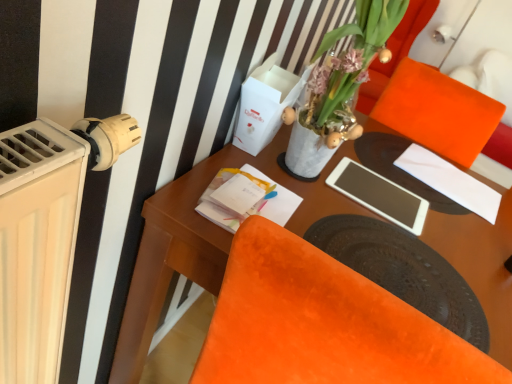
You are a GUI agent. You are given a task and a screenshot of the screen. Output one action in this format:
    pyautogui.click(x=<x>, y=<y>)
    Task: Click on the vacant space in between white matte tablet at center and velvet orange chair at lower right
    This screenshot has width=512, height=384.
    Given the screenshot: What is the action you would take?
    pyautogui.click(x=405, y=231)